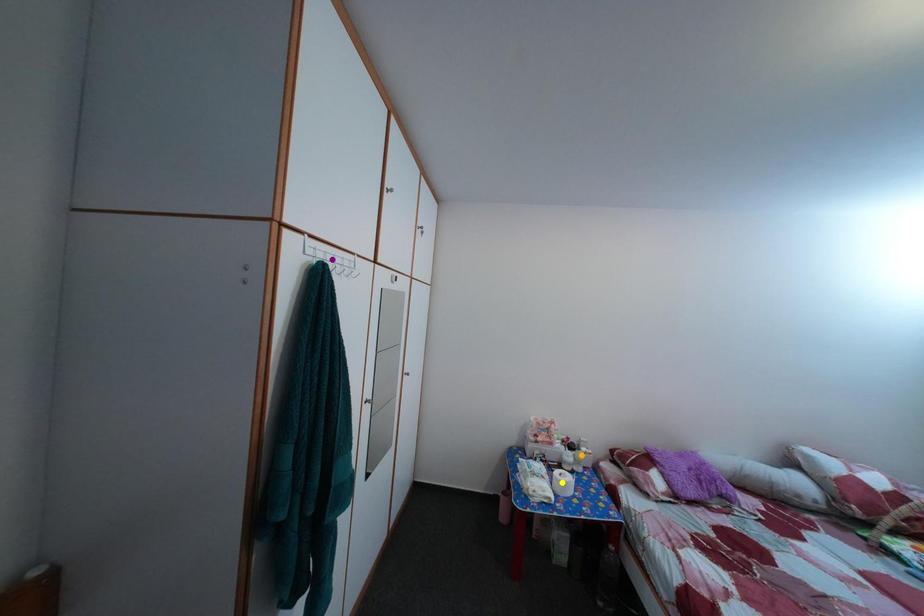
Order these from nearest to farthest:
1. orange point
2. yellow point
3. purple point

1. orange point
2. yellow point
3. purple point